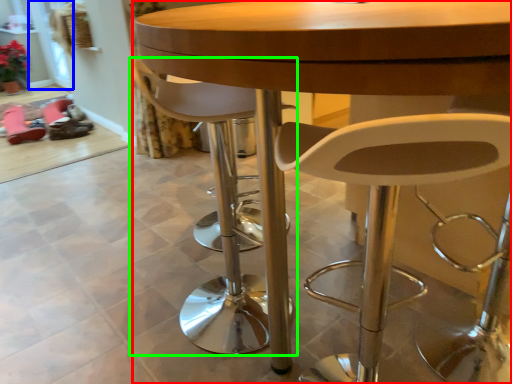
Question: Estimate the real-world distances between objects in this image. Which object is closer to table (highlighted by a red box), glass door (highlighted by a blue box) or chair (highlighted by a green box)?

Choices:
 (A) glass door
 (B) chair

Answer: (B)